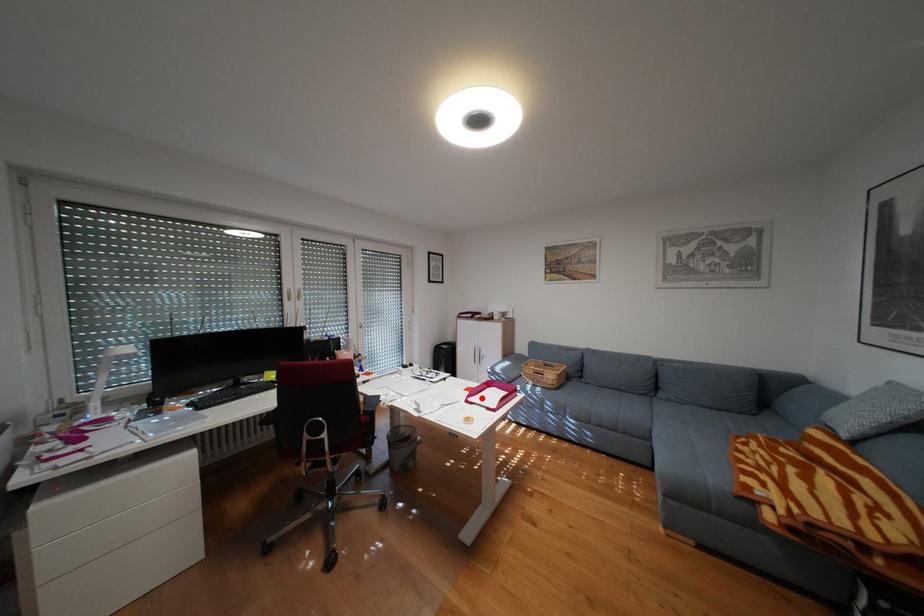
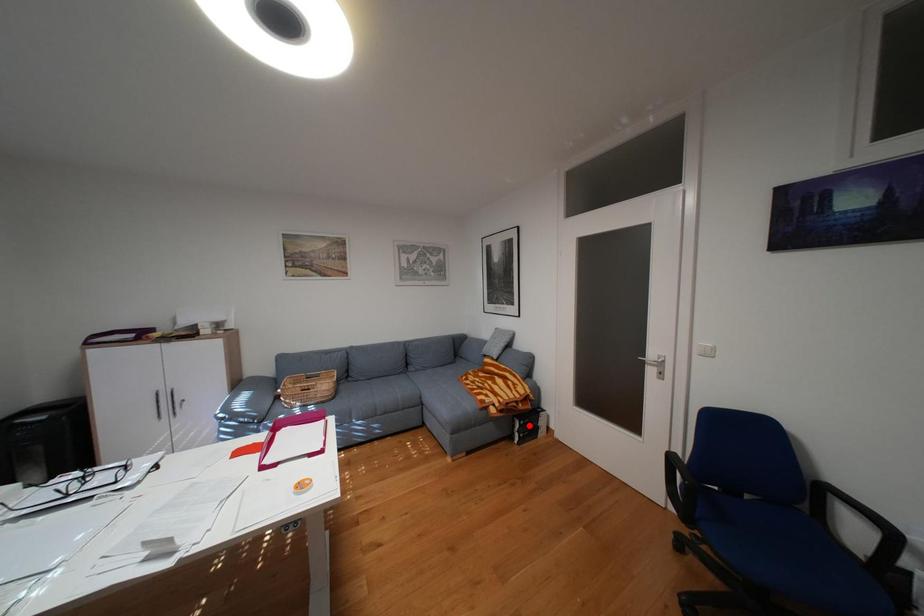
I am providing you with two images of the same scene from different viewpoints. A red point is marked on the first image and another point is marked on the second image. Is the red point in image1 aligned with the point shown in image2?

No